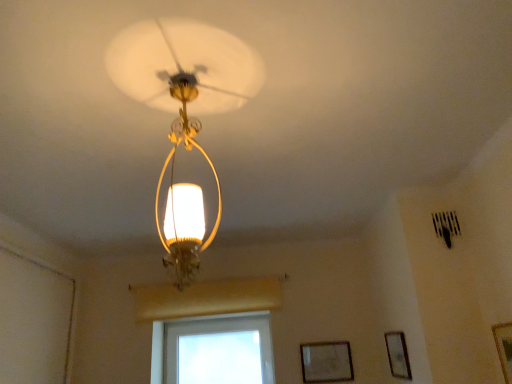
Question: Can you confirm if wooden framed picture at lower right, which appears as the 1th picture frame when viewed from the left, is positioned to the left of wooden picture frame at lower right, arranged as the 2th picture frame when viewed from the front?

Choices:
 (A) no
 (B) yes

Answer: (B)

Question: Considering the relative sizes of wooden framed picture at lower right, positioned as the 1th picture frame in back-to-front order, and wooden picture frame at lower right, the second picture frame in the right-to-left sequence, in the image provided, is wooden framed picture at lower right, positioned as the 1th picture frame in back-to-front order, smaller than wooden picture frame at lower right, the second picture frame in the right-to-left sequence,?

Choices:
 (A) no
 (B) yes

Answer: (B)

Question: From the image's perspective, would you say wooden framed picture at lower right, which appears as the 1th picture frame when viewed from the left, is shown under wooden picture frame at lower right, the second picture frame in the right-to-left sequence?

Choices:
 (A) no
 (B) yes

Answer: (B)

Question: Considering the relative sizes of wooden framed picture at lower right, positioned as the 1th picture frame in back-to-front order, and wooden picture frame at lower right, arranged as the 2th picture frame when viewed from the front, in the image provided, is wooden framed picture at lower right, positioned as the 1th picture frame in back-to-front order, taller than wooden picture frame at lower right, arranged as the 2th picture frame when viewed from the front,?

Choices:
 (A) no
 (B) yes

Answer: (A)

Question: Does wooden framed picture at lower right, placed as the third picture frame when sorted from right to left, touch wooden picture frame at lower right, arranged as the 2th picture frame when viewed from the front?

Choices:
 (A) no
 (B) yes

Answer: (A)

Question: Visually, is wooden framed picture at lower right, positioned as the 1th picture frame in back-to-front order, positioned to the left or to the right of transparent glass window at center?

Choices:
 (A) right
 (B) left

Answer: (A)

Question: Is wooden framed picture at lower right, placed as the third picture frame when sorted from right to left, in front of or behind transparent glass window at center in the image?

Choices:
 (A) front
 (B) behind

Answer: (A)

Question: Is wooden framed picture at lower right, the 3th picture frame in the front-to-back sequence, spatially inside transparent glass window at center, or outside of it?

Choices:
 (A) outside
 (B) inside

Answer: (A)

Question: From a real-world perspective, is wooden framed picture at lower right, the 3th picture frame in the front-to-back sequence, above or below transparent glass window at center?

Choices:
 (A) above
 (B) below

Answer: (B)

Question: From the image's perspective, is matte gold chandelier at center located above or below wooden picture frame at lower right, the 2th picture frame viewed from the back?

Choices:
 (A) below
 (B) above

Answer: (B)

Question: Does point (185, 281) appear closer or farther from the camera than point (398, 375)?

Choices:
 (A) farther
 (B) closer

Answer: (B)

Question: From a real-world perspective, relative to wooden picture frame at lower right, the second picture frame in the right-to-left sequence, is matte gold chandelier at center vertically above or below?

Choices:
 (A) below
 (B) above

Answer: (B)

Question: In the image, is matte gold chandelier at center on the left side or the right side of wooden picture frame at lower right, arranged as the 2th picture frame when viewed from the front?

Choices:
 (A) left
 (B) right

Answer: (A)

Question: From their relative heights in the image, would you say transparent glass window at center is taller or shorter than wooden framed picture at lower right, placed as the third picture frame when sorted from right to left?

Choices:
 (A) short
 (B) tall

Answer: (B)

Question: Is transparent glass window at center wider or thinner than wooden framed picture at lower right, the 3th picture frame in the front-to-back sequence?

Choices:
 (A) thin
 (B) wide

Answer: (B)